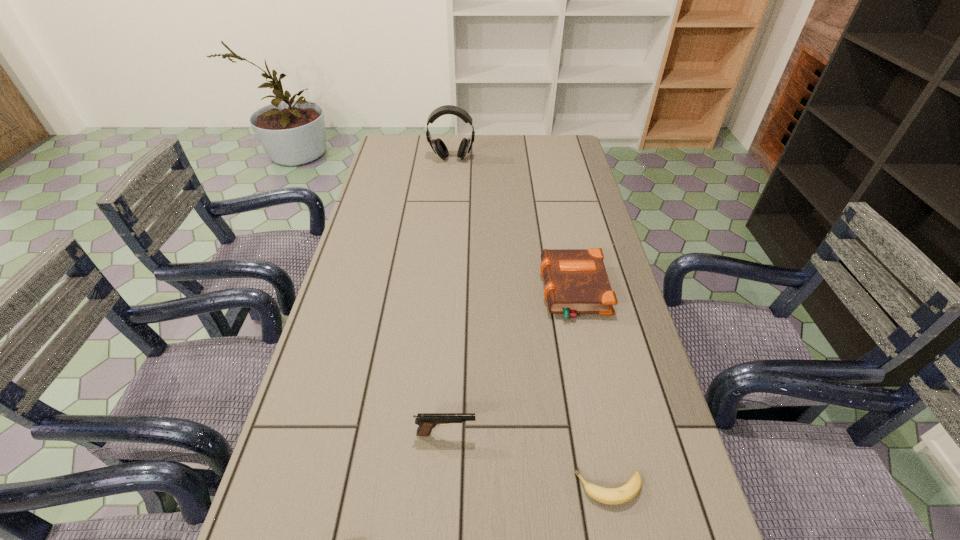
I want to click on blank space located 0.140m on the spine side of the third tallest object, so click(492, 291).

Where is `free space located 0.250m on the spine side of the third tallest object`? The width and height of the screenshot is (960, 540). free space located 0.250m on the spine side of the third tallest object is located at coordinates (451, 291).

Find the location of `vacant space located on the spine side of the third tallest object`. vacant space located on the spine side of the third tallest object is located at coordinates (492, 291).

The width and height of the screenshot is (960, 540). I want to click on vacant space located 0.140m at the stem of the shortest object, so click(503, 488).

At what (x,y) coordinates should I click in order to perform the action: click on blank space located at the stem of the shortest object. Please return your answer as a coordinate pair (x, y). Looking at the image, I should click on (535, 488).

You are a GUI agent. You are given a task and a screenshot of the screen. Output one action in this format:
    pyautogui.click(x=<x>, y=<y>)
    Task: Click on the free space located at the stem of the shortest object
    The height and width of the screenshot is (540, 960).
    Given the screenshot: What is the action you would take?
    pyautogui.click(x=503, y=488)

Find the location of a particular element. object present at the far edge is located at coordinates (438, 146).

Find the location of a particular element. The image size is (960, 540). Bible present at the right edge is located at coordinates (576, 282).

Identify the location of banana at the right edge. The height and width of the screenshot is (540, 960). (613, 496).

The height and width of the screenshot is (540, 960). In the image, there is a desktop. Identify the location of vacant space at the far edge. (465, 159).